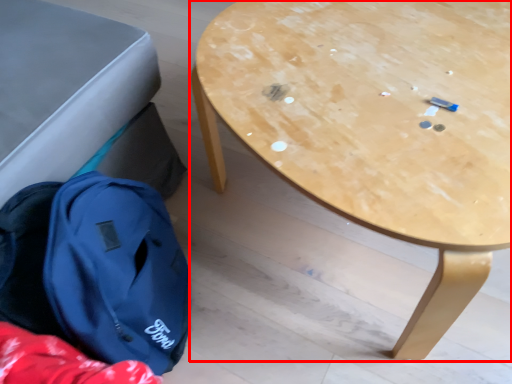
Question: From the image's perspective, what is the correct spatial relationship of table (annotated by the red box) in relation to backpack?

Choices:
 (A) above
 (B) below

Answer: (A)